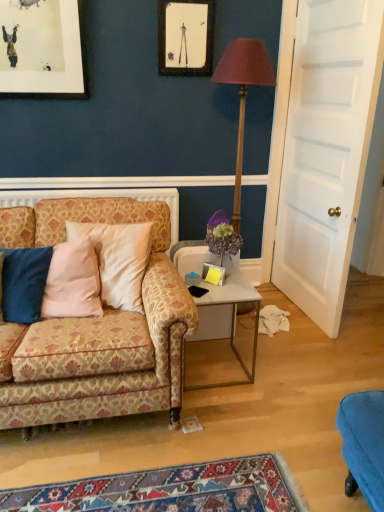
In order to click on vacant space underneath white glossy side table at center (from a real-world perspective) in this screenshot , I will do `click(210, 365)`.